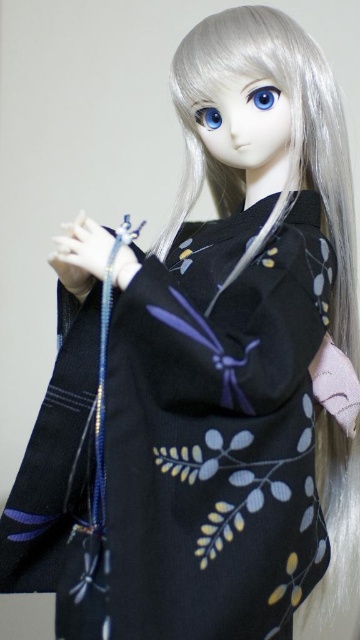
Between blue glossy eye at center and blue glossy eye at upper center, which one appears on the right side from the viewer's perspective?

blue glossy eye at center is more to the right.

Which of these two, blue glossy eye at center or blue glossy eye at upper center, stands shorter?

blue glossy eye at upper center is shorter.

Locate an element on the screen. blue glossy eye at center is located at coordinates (263, 97).